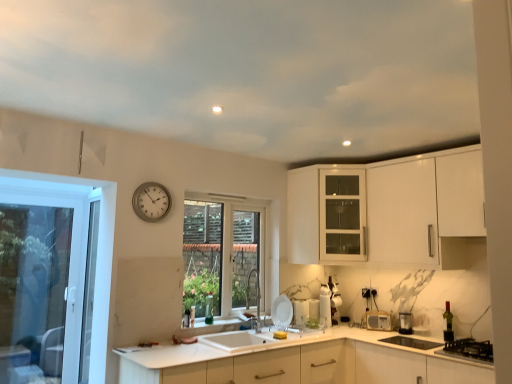
Question: Can you confirm if metallic silver toaster at lower right, positioned as the 1th appliance in right-to-left order, is shorter than white glossy microwave at lower center, which appears as the 2th appliance when viewed from the right?

Choices:
 (A) yes
 (B) no

Answer: (B)

Question: Can you confirm if metallic silver toaster at lower right, positioned as the 1th appliance in right-to-left order, is wider than white glossy microwave at lower center, which is the 3th appliance in left-to-right order?

Choices:
 (A) no
 (B) yes

Answer: (B)

Question: Considering the relative sizes of metallic silver toaster at lower right, positioned as the 1th appliance in right-to-left order, and white glossy microwave at lower center, which appears as the 2th appliance when viewed from the right, in the image provided, is metallic silver toaster at lower right, positioned as the 1th appliance in right-to-left order, taller than white glossy microwave at lower center, which appears as the 2th appliance when viewed from the right,?

Choices:
 (A) no
 (B) yes

Answer: (B)

Question: Is white glossy microwave at lower center, which is the 3th appliance in left-to-right order, located within metallic silver toaster at lower right, positioned as the 1th appliance in right-to-left order?

Choices:
 (A) no
 (B) yes

Answer: (A)

Question: From the image's perspective, is metallic silver toaster at lower right, positioned as the 1th appliance in right-to-left order, located beneath white glossy microwave at lower center, which is the 3th appliance in left-to-right order?

Choices:
 (A) yes
 (B) no

Answer: (B)

Question: Looking at their shapes, would you say white matte countertop at center is wider or thinner than black matte gas stove at lower right?

Choices:
 (A) wide
 (B) thin

Answer: (A)

Question: Is white matte countertop at center spatially inside black matte gas stove at lower right, or outside of it?

Choices:
 (A) outside
 (B) inside

Answer: (A)

Question: Based on their sizes in the image, would you say white matte countertop at center is bigger or smaller than black matte gas stove at lower right?

Choices:
 (A) small
 (B) big

Answer: (B)

Question: From a real-world perspective, relative to black matte gas stove at lower right, is white matte countertop at center vertically above or below?

Choices:
 (A) below
 (B) above

Answer: (A)

Question: Is metallic silver toaster at lower right, which is the fourth appliance from left to right, situated inside white glossy plate at sink, placed as the fourth appliance when sorted from right to left, or outside?

Choices:
 (A) inside
 (B) outside

Answer: (B)

Question: From the image's perspective, is metallic silver toaster at lower right, positioned as the 1th appliance in right-to-left order, above or below white glossy plate at sink, the first appliance positioned from the left?

Choices:
 (A) below
 (B) above

Answer: (A)

Question: From a real-world perspective, is metallic silver toaster at lower right, which is the fourth appliance from left to right, positioned above or below white glossy plate at sink, the first appliance positioned from the left?

Choices:
 (A) below
 (B) above

Answer: (A)

Question: From their relative heights in the image, would you say metallic silver toaster at lower right, which is the fourth appliance from left to right, is taller or shorter than white glossy plate at sink, placed as the fourth appliance when sorted from right to left?

Choices:
 (A) tall
 (B) short

Answer: (B)

Question: From a real-world perspective, is white glossy soap dispenser at center, placed as the 2th appliance when sorted from left to right, above or below silver metallic clock at upper left?

Choices:
 (A) above
 (B) below

Answer: (B)

Question: Is white glossy soap dispenser at center, placed as the 2th appliance when sorted from left to right, taller or shorter than silver metallic clock at upper left?

Choices:
 (A) short
 (B) tall

Answer: (A)